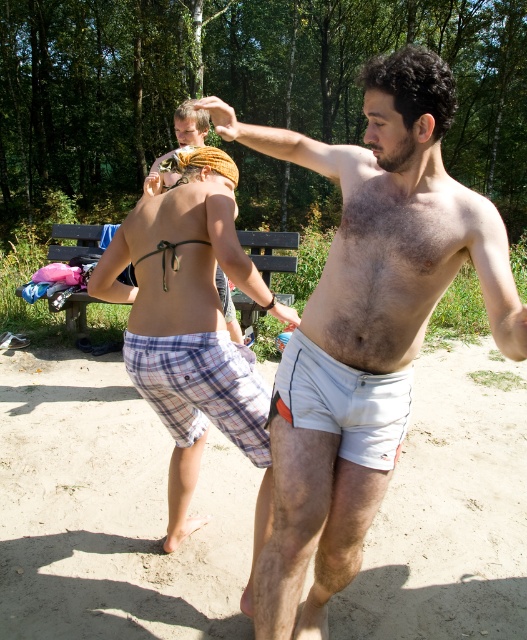
Is white cotton shorts at right below plaid shorts at center?

Yes.

Image resolution: width=527 pixels, height=640 pixels. I want to click on white cotton shorts at right, so click(x=365, y=326).

Is plaid fabric shorts at center below plaid shorts at center?

Correct, plaid fabric shorts at center is located below plaid shorts at center.

What do you see at coordinates (192, 330) in the screenshot? I see `plaid fabric shorts at center` at bounding box center [192, 330].

Find the location of `plaid fabric shorts at center`. plaid fabric shorts at center is located at coordinates (192, 330).

Image resolution: width=527 pixels, height=640 pixels. I want to click on plaid fabric shorts at center, so click(192, 330).

From the picture: Who is higher up, white sandy beach at lower center or white cotton shorts at right?

white cotton shorts at right

Between point (463, 502) and point (358, 454), which one is positioned behind?

Point (463, 502)

Between point (9, 579) and point (347, 516), which one is positioned in front?

Point (347, 516) is more forward.

This screenshot has width=527, height=640. What are the coordinates of `white sandy beach at lower center` in the screenshot? It's located at (111, 513).